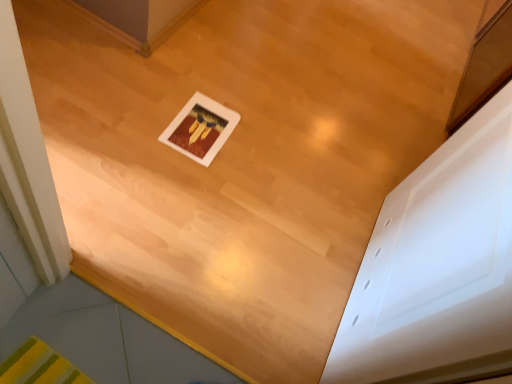
What is the approximate width of white matte picture frame at center?

12.01 inches.

Find the location of a particular element. This screenshot has width=512, height=384. white matte picture frame at center is located at coordinates (200, 129).

This screenshot has height=384, width=512. What do you see at coordinates (200, 129) in the screenshot?
I see `white matte picture frame at center` at bounding box center [200, 129].

You are a GUI agent. You are given a task and a screenshot of the screen. Output one action in this format:
    pyautogui.click(x=<x>, y=<y>)
    Task: Click on the white matte picture frame at center
    Image resolution: width=512 pixels, height=384 pixels.
    Given the screenshot: What is the action you would take?
    pyautogui.click(x=200, y=129)